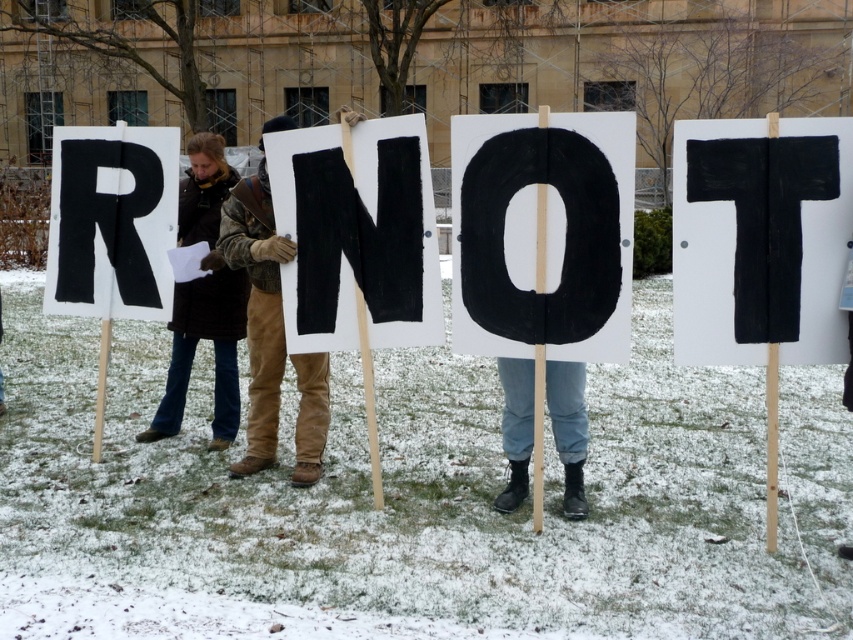
Does point (144, 241) lie behind point (305, 467)?

Yes, point (144, 241) is behind point (305, 467).

Is point (78, 256) more distant than point (276, 385)?

Yes.

This screenshot has width=853, height=640. Identify the location of black painted wood letter r at left. (112, 221).

Is black painted sign at center thinner than brown leather jacket at left?

No, black painted sign at center is not thinner than brown leather jacket at left.

Who is shorter, black painted sign at center or brown leather jacket at left?

black painted sign at center is shorter.

Between point (473, 148) and point (231, 355), which one is positioned in front?

Point (473, 148) is more forward.

Locate an element on the screen. Image resolution: width=853 pixels, height=640 pixels. black painted sign at center is located at coordinates (544, 234).

Does black fabric t-shirt at right have a lesser width compared to black painted wood at center?

Yes.

Does black fabric t-shirt at right appear on the right side of black painted wood at center?

Indeed, black fabric t-shirt at right is positioned on the right side of black painted wood at center.

Does point (750, 243) come closer to viewer compared to point (380, 340)?

Yes, point (750, 243) is in front of point (380, 340).

Where is `black fabric t-shirt at right`? The image size is (853, 640). black fabric t-shirt at right is located at coordinates (759, 240).